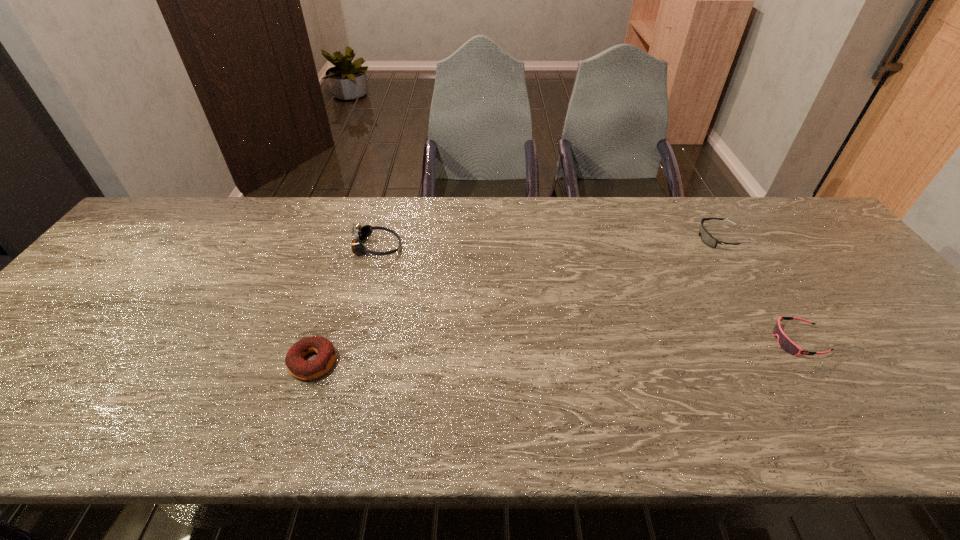
The image size is (960, 540). What are the coordinates of `the tallest object` in the screenshot? It's located at (361, 232).

I want to click on the leftmost goggles, so click(361, 232).

The width and height of the screenshot is (960, 540). What are the coordinates of `doughnut` in the screenshot? It's located at (302, 369).

Where is `the shortest goggles`? The image size is (960, 540). the shortest goggles is located at coordinates (785, 343).

This screenshot has height=540, width=960. I want to click on free space located through the lenses of the leftmost goggles, so click(518, 247).

Where is `free space located on the front of the doughnut`? This screenshot has height=540, width=960. free space located on the front of the doughnut is located at coordinates (297, 412).

Locate an element on the screen. Image resolution: width=960 pixels, height=540 pixels. blank area located 0.140m on the front-facing side of the shortest goggles is located at coordinates (714, 341).

Locate an element on the screen. vacant space situated 0.230m on the front-facing side of the shortest goggles is located at coordinates (676, 341).

In order to click on vacant space located on the front-facing side of the shortest goggles in this screenshot , I will do `click(710, 341)`.

Find the location of a particular element. vacant space at the far edge of the desktop is located at coordinates (468, 227).